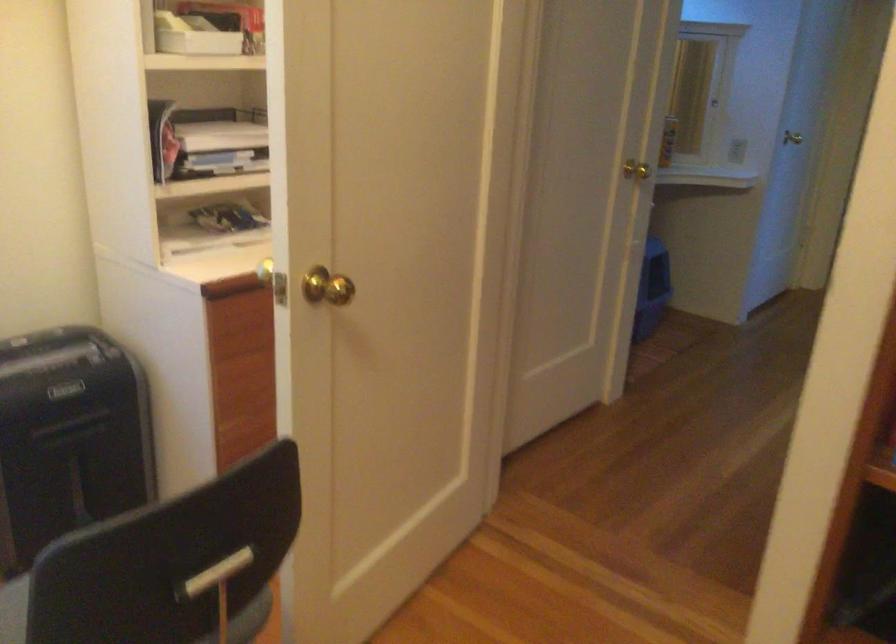
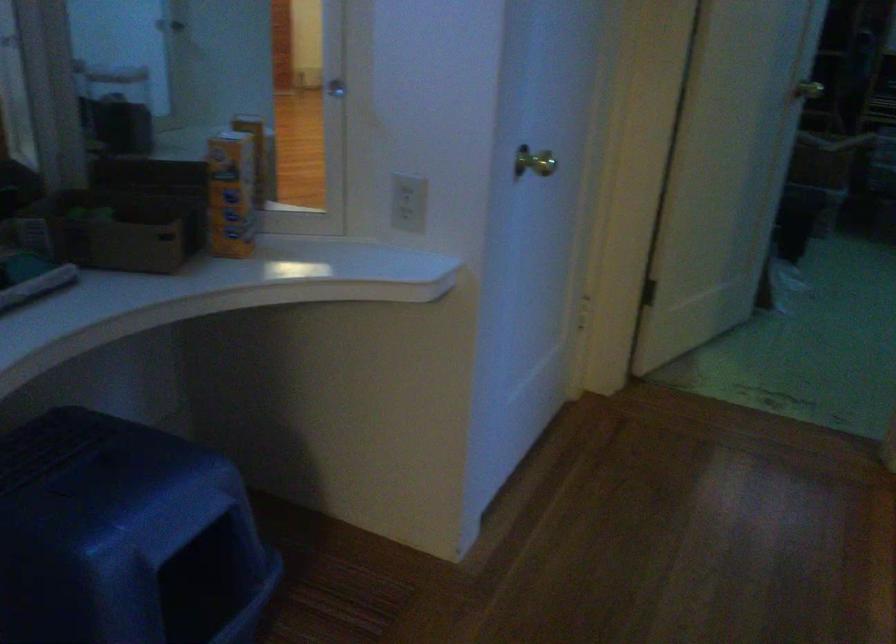
Which direction would the cameraman need to move to produce the second image?

The cameraman walked toward right, forward.